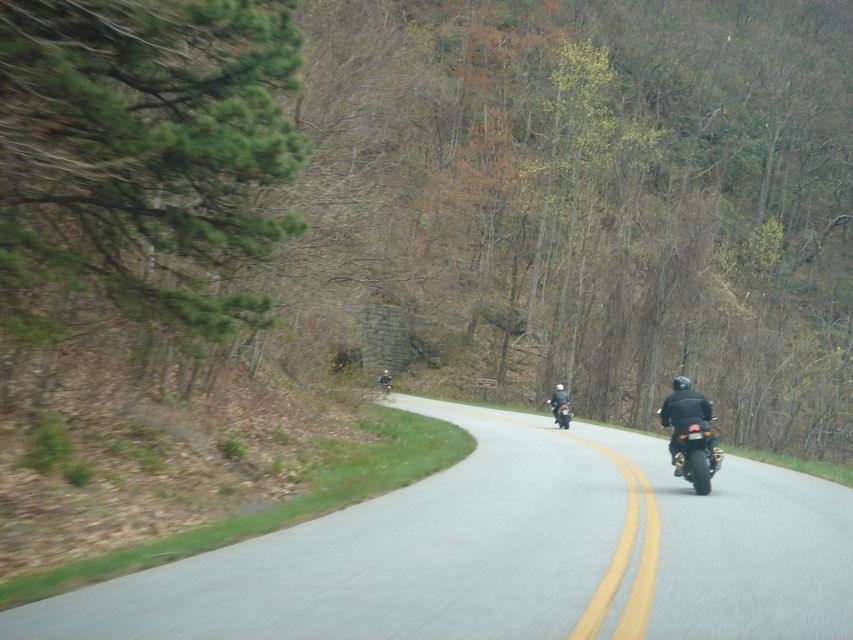
Question: Is green leafy tree at upper left to the left of black matte motorcycle at center from the viewer's perspective?

Choices:
 (A) yes
 (B) no

Answer: (B)

Question: Considering the relative positions of green leafy tree at upper left and black matte motorcycle at center in the image provided, where is green leafy tree at upper left located with respect to black matte motorcycle at center?

Choices:
 (A) right
 (B) left

Answer: (A)

Question: Which point is farther to the camera?

Choices:
 (A) (698, 424)
 (B) (561, 420)
 (C) (780, 493)

Answer: (B)

Question: Is the position of gray asphalt road at center more distant than that of black leather jacket at right?

Choices:
 (A) no
 (B) yes

Answer: (A)

Question: Which object appears farthest from the camera in this image?

Choices:
 (A) black matte motorcycle at center
 (B) shiny black motorcycle at right

Answer: (A)

Question: Based on their relative distances, which object is nearer to the black matte motorcycle at center?

Choices:
 (A) black leather jacket at right
 (B) green leafy tree at upper left
 (C) shiny black motorcycle at right
 (D) gray asphalt road at center

Answer: (D)